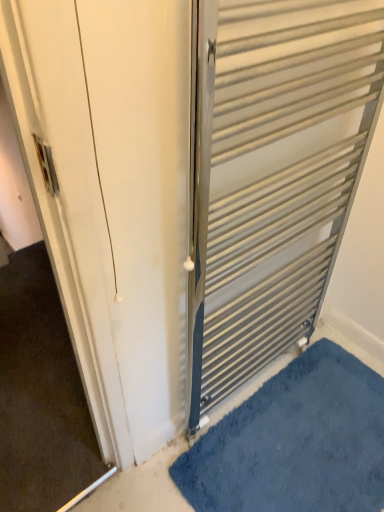
What is the approximate height of blue shaggy bath mat at lower right?

The height of blue shaggy bath mat at lower right is 1.68 inches.

This screenshot has width=384, height=512. Describe the element at coordinates (295, 442) in the screenshot. I see `blue shaggy bath mat at lower right` at that location.

This screenshot has width=384, height=512. Find the location of `blue shaggy bath mat at lower right`. blue shaggy bath mat at lower right is located at coordinates (295, 442).

The height and width of the screenshot is (512, 384). What do you see at coordinates (274, 173) in the screenshot?
I see `metallic silver radiator at right` at bounding box center [274, 173].

Image resolution: width=384 pixels, height=512 pixels. I want to click on metallic silver radiator at right, so click(x=274, y=173).

I want to click on blue shaggy bath mat at lower right, so click(x=295, y=442).

From the picture: Considering the relative positions of metallic silver radiator at right and blue shaggy bath mat at lower right in the image provided, is metallic silver radiator at right to the left of blue shaggy bath mat at lower right from the viewer's perspective?

Correct, you'll find metallic silver radiator at right to the left of blue shaggy bath mat at lower right.

Is the depth of metallic silver radiator at right less than that of blue shaggy bath mat at lower right?

Yes, it is in front of blue shaggy bath mat at lower right.

Is point (262, 126) closer to viewer compared to point (229, 484)?

Yes, it is in front of point (229, 484).

In the scene shown: From the image's perspective, is metallic silver radiator at right on top of blue shaggy bath mat at lower right?

Indeed, from the image's perspective, metallic silver radiator at right is shown above blue shaggy bath mat at lower right.

From a real-world perspective, between metallic silver radiator at right and blue shaggy bath mat at lower right, who is vertically higher?

In real-world perspective, metallic silver radiator at right is above.

Which of these two, metallic silver radiator at right or blue shaggy bath mat at lower right, is wider?

blue shaggy bath mat at lower right is wider.

Is metallic silver radiator at right taller or shorter than blue shaggy bath mat at lower right?

Considering their sizes, metallic silver radiator at right has more height than blue shaggy bath mat at lower right.

Considering the relative sizes of metallic silver radiator at right and blue shaggy bath mat at lower right in the image provided, is metallic silver radiator at right bigger than blue shaggy bath mat at lower right?

Correct, metallic silver radiator at right is larger in size than blue shaggy bath mat at lower right.

Looking at this image, which is correct: metallic silver radiator at right is inside blue shaggy bath mat at lower right, or outside of it?

metallic silver radiator at right is outside blue shaggy bath mat at lower right.

Is metallic silver radiator at right positioned far away from blue shaggy bath mat at lower right?

Actually, metallic silver radiator at right and blue shaggy bath mat at lower right are a little close together.

Is metallic silver radiator at right turned away from blue shaggy bath mat at lower right?

No.

How many degrees apart are the facing directions of metallic silver radiator at right and blue shaggy bath mat at lower right?

They differ by 180 degrees in their facing directions.

Measure the distance from metallic silver radiator at right to blue shaggy bath mat at lower right.

20.39 inches.

This screenshot has width=384, height=512. I want to click on door above the blue shaggy bath mat at lower right (from the image's perspective), so click(274, 173).

Between blue shaggy bath mat at lower right and metallic silver radiator at right, which one appears on the right side from the viewer's perspective?

From the viewer's perspective, blue shaggy bath mat at lower right appears more on the right side.

Does blue shaggy bath mat at lower right come in front of metallic silver radiator at right?

No, blue shaggy bath mat at lower right is behind metallic silver radiator at right.

Which is in front, point (357, 413) or point (192, 419)?

Positioned in front is point (192, 419).

From the image's perspective, which one is positioned higher, blue shaggy bath mat at lower right or metallic silver radiator at right?

metallic silver radiator at right appears higher in the image.

From a real-world perspective, which object rests below the other?

blue shaggy bath mat at lower right is physically lower.

Considering the sizes of objects blue shaggy bath mat at lower right and metallic silver radiator at right in the image provided, who is wider, blue shaggy bath mat at lower right or metallic silver radiator at right?

Wider between the two is blue shaggy bath mat at lower right.

Who is shorter, blue shaggy bath mat at lower right or metallic silver radiator at right?

Standing shorter between the two is blue shaggy bath mat at lower right.

Considering the sizes of objects blue shaggy bath mat at lower right and metallic silver radiator at right in the image provided, who is smaller, blue shaggy bath mat at lower right or metallic silver radiator at right?

Smaller between the two is blue shaggy bath mat at lower right.

Is blue shaggy bath mat at lower right not inside metallic silver radiator at right?

Yes, blue shaggy bath mat at lower right is not within metallic silver radiator at right.

Is blue shaggy bath mat at lower right next to metallic silver radiator at right and touching it?

No, blue shaggy bath mat at lower right is not with metallic silver radiator at right.

Is blue shaggy bath mat at lower right looking in the opposite direction of metallic silver radiator at right?

blue shaggy bath mat at lower right does not have its back to metallic silver radiator at right.

Looking at this image, measure the distance between blue shaggy bath mat at lower right and metallic silver radiator at right.

blue shaggy bath mat at lower right and metallic silver radiator at right are 20.39 inches apart.

Locate an element on the screen. The image size is (384, 512). door above the blue shaggy bath mat at lower right (from the image's perspective) is located at coordinates (274, 173).

You are a GUI agent. You are given a task and a screenshot of the screen. Output one action in this format:
    pyautogui.click(x=<x>, y=<y>)
    Task: Click on the bath mat behind the metallic silver radiator at right
    
    Given the screenshot: What is the action you would take?
    pyautogui.click(x=295, y=442)

Find the location of `door above the blue shaggy bath mat at lower right (from the image's perspective)`. door above the blue shaggy bath mat at lower right (from the image's perspective) is located at coordinates (274, 173).